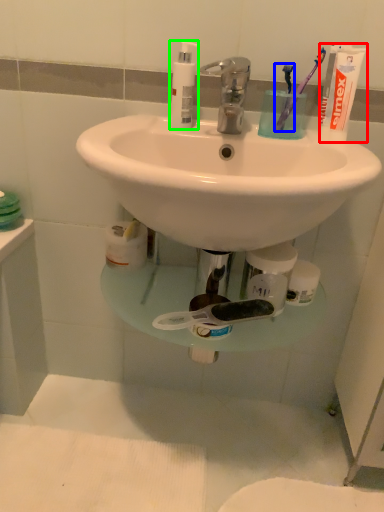
Question: Which object is the closest to the toothpaste (highlighted by a red box)? Choose among these: toothbrush (highlighted by a blue box) or soap dispenser (highlighted by a green box).

Choices:
 (A) toothbrush
 (B) soap dispenser

Answer: (A)